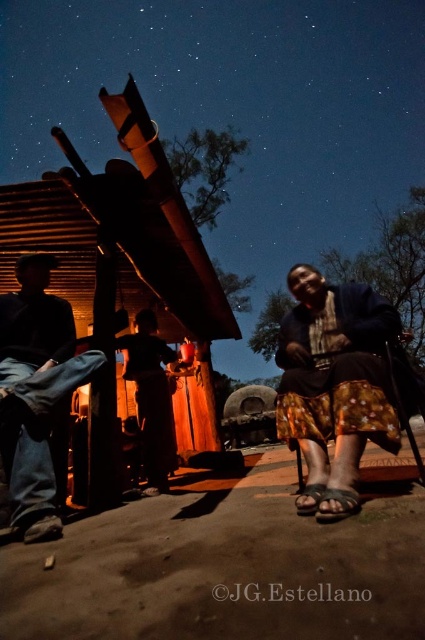
You are a photographer setting up a tripod between the printed fabric skirt at lower right and the brushed metal pants at lower left. The tripod requires a minimum of 1.5 meters of space to avoid obstruction. Can you safely set it up in this location?

The distance between the printed fabric skirt at lower right and the brushed metal pants at lower left is 1.62 meters, which exceeds the tripod requirement of 1.5 meters. Therefore, you can safely set up the tripod between them without obstruction.

From the picture: You are designing a new outfit and need to choose between the printed fabric skirt at lower right and the brushed metal pants at lower left. Based on their widths, which one would you pick if you want something narrower?

The printed fabric skirt at lower right has a lesser width compared to the brushed metal pants at lower left, so it would be the better choice for a narrower option.